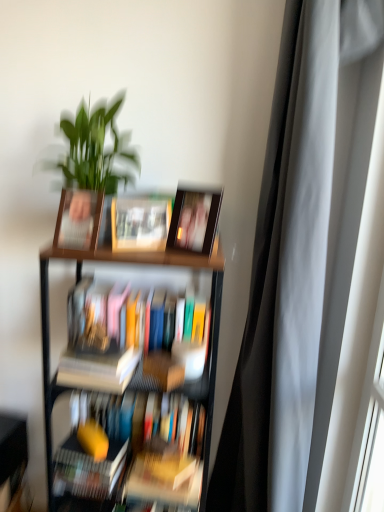
Question: Does hardcover book at lower left, acting as the 1th book starting from the bottom, appear on the left side of wooden bookshelf at lower left?

Choices:
 (A) no
 (B) yes

Answer: (A)

Question: Does hardcover book at lower left, the 4th book from the top, have a lesser width compared to wooden bookshelf at lower left?

Choices:
 (A) yes
 (B) no

Answer: (A)

Question: Is hardcover book at lower left, the 4th book from the top, closer to the viewer compared to wooden bookshelf at lower left?

Choices:
 (A) yes
 (B) no

Answer: (A)

Question: Is hardcover book at lower left, the 4th book from the top, positioned with its back to wooden bookshelf at lower left?

Choices:
 (A) yes
 (B) no

Answer: (B)

Question: From the image's perspective, is hardcover book at lower left, acting as the 1th book starting from the bottom, located beneath wooden bookshelf at lower left?

Choices:
 (A) yes
 (B) no

Answer: (B)

Question: In the image, is silky gray curtain at right on the left side or the right side of wooden bookshelf at lower left?

Choices:
 (A) right
 (B) left

Answer: (A)

Question: In terms of width, does silky gray curtain at right look wider or thinner when compared to wooden bookshelf at lower left?

Choices:
 (A) wide
 (B) thin

Answer: (A)

Question: In terms of size, does silky gray curtain at right appear bigger or smaller than wooden bookshelf at lower left?

Choices:
 (A) big
 (B) small

Answer: (A)

Question: Does point (x=319, y=246) appear closer or farther from the camera than point (x=13, y=462)?

Choices:
 (A) farther
 (B) closer

Answer: (B)

Question: Relative to silky gray curtain at right, is wooden bookshelf at lower left in front or behind?

Choices:
 (A) behind
 (B) front

Answer: (A)

Question: Based on their sizes in the image, would you say wooden bookshelf at lower left is bigger or smaller than silky gray curtain at right?

Choices:
 (A) small
 (B) big

Answer: (A)

Question: Visually, is wooden bookshelf at lower left positioned to the left or to the right of silky gray curtain at right?

Choices:
 (A) right
 (B) left

Answer: (B)

Question: Considering the positions of wooden bookshelf at lower left and silky gray curtain at right in the image, is wooden bookshelf at lower left taller or shorter than silky gray curtain at right?

Choices:
 (A) short
 (B) tall

Answer: (A)

Question: From the image's perspective, relative to matte wooden picture frame at upper center, placed as the second picture frame when sorted from left to right, is matte wooden photo frame at center, which is counted as the first book, starting from the top, above or below?

Choices:
 (A) below
 (B) above

Answer: (A)

Question: Looking at their shapes, would you say matte wooden photo frame at center, which is the 4th book in bottom-to-top order, is wider or thinner than matte wooden picture frame at upper center, placed as the second picture frame when sorted from left to right?

Choices:
 (A) wide
 (B) thin

Answer: (B)